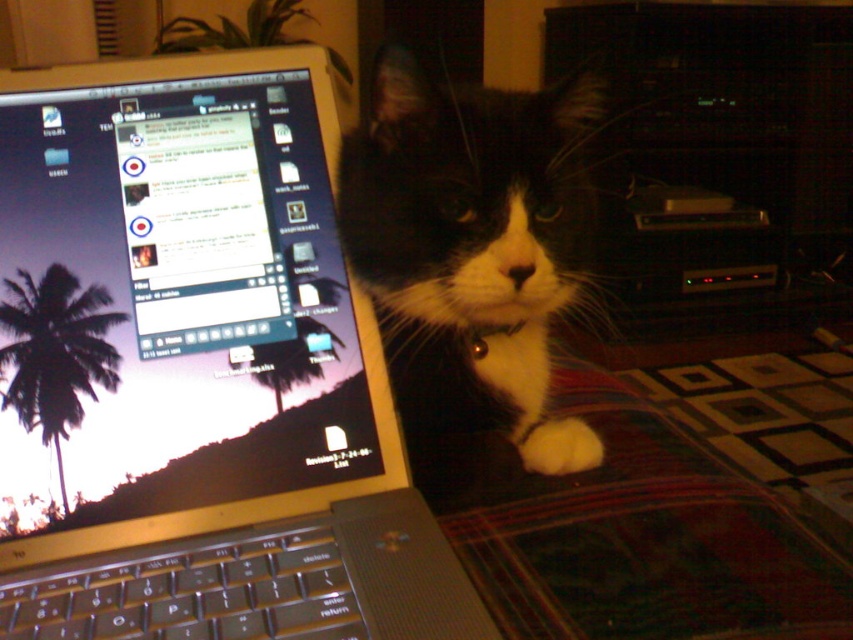
Question: Does black fur cat at center have a smaller size compared to black plastic keyboard at lower left?

Choices:
 (A) yes
 (B) no

Answer: (B)

Question: Where is silver metallic laptop at center located in relation to black fur cat at center in the image?

Choices:
 (A) right
 (B) left

Answer: (B)

Question: Is black fur cat at center further to camera compared to black plastic keyboard at lower left?

Choices:
 (A) yes
 (B) no

Answer: (A)

Question: Which object is closer to the camera taking this photo?

Choices:
 (A) silver metallic laptop at center
 (B) white fluffy paw at lower right
 (C) black fur cat at center
 (D) black plastic keyboard at lower left

Answer: (A)

Question: Which object appears closest to the camera in this image?

Choices:
 (A) black fur cat at center
 (B) white fluffy paw at lower right

Answer: (A)

Question: Which is farther from the silver metallic laptop at center?

Choices:
 (A) white fluffy paw at lower right
 (B) black plastic keyboard at lower left
 (C) black fur cat at center

Answer: (A)